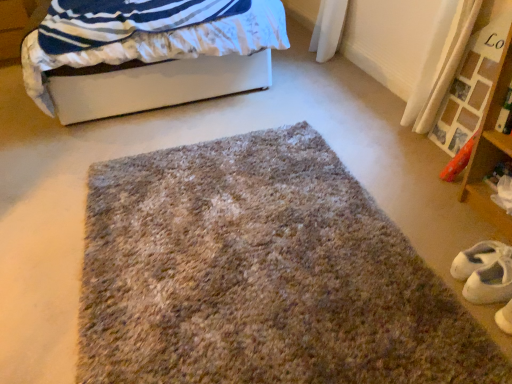
Question: Should I look upward or downward to see white smooth bed at upper left?

Choices:
 (A) down
 (B) up

Answer: (B)

Question: Is fuzzy carpet at center a part of white smooth bed at upper left?

Choices:
 (A) yes
 (B) no

Answer: (B)

Question: From the image's perspective, is white smooth bed at upper left on fuzzy carpet at center?

Choices:
 (A) yes
 (B) no

Answer: (A)

Question: Considering the relative sizes of white smooth bed at upper left and fuzzy carpet at center in the image provided, is white smooth bed at upper left smaller than fuzzy carpet at center?

Choices:
 (A) no
 (B) yes

Answer: (A)

Question: From the image's perspective, is white smooth bed at upper left under fuzzy carpet at center?

Choices:
 (A) yes
 (B) no

Answer: (B)

Question: Is white smooth bed at upper left taller than fuzzy carpet at center?

Choices:
 (A) no
 (B) yes

Answer: (B)

Question: Is white smooth bed at upper left facing towards fuzzy carpet at center?

Choices:
 (A) no
 (B) yes

Answer: (B)

Question: Can you see fuzzy carpet at center touching white smooth bed at upper left?

Choices:
 (A) yes
 (B) no

Answer: (B)

Question: Would you say fuzzy carpet at center is outside white smooth bed at upper left?

Choices:
 (A) no
 (B) yes

Answer: (B)

Question: Can you confirm if fuzzy carpet at center is positioned to the right of white smooth bed at upper left?

Choices:
 (A) no
 (B) yes

Answer: (B)

Question: Does fuzzy carpet at center come in front of white smooth bed at upper left?

Choices:
 (A) yes
 (B) no

Answer: (A)

Question: From the image's perspective, is fuzzy carpet at center under white smooth bed at upper left?

Choices:
 (A) yes
 (B) no

Answer: (A)

Question: Considering the relative sizes of fuzzy carpet at center and white smooth bed at upper left in the image provided, is fuzzy carpet at center taller than white smooth bed at upper left?

Choices:
 (A) no
 (B) yes

Answer: (A)

Question: Can you see white suede shoe at lower right touching fuzzy carpet at center?

Choices:
 (A) no
 (B) yes

Answer: (A)